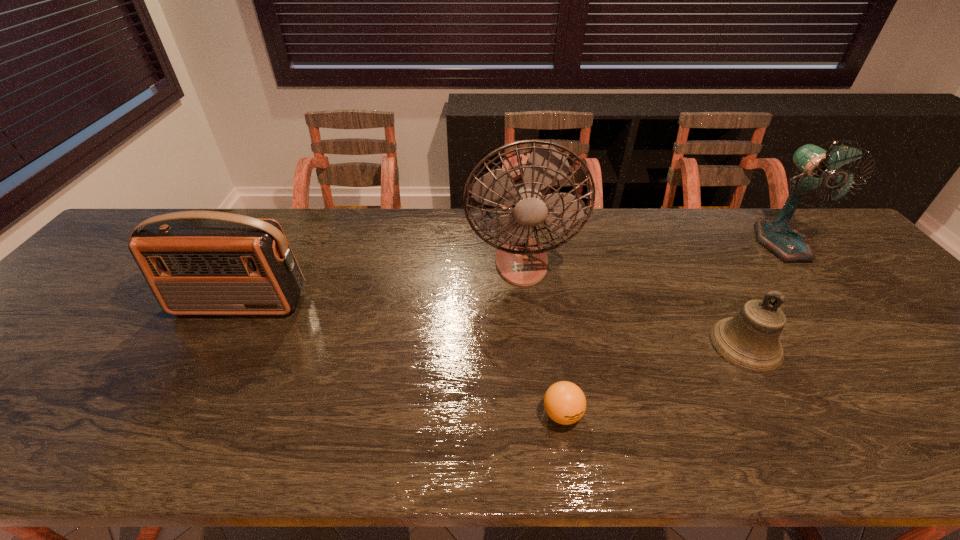
In the image, there is a desktop. Identify the location of free region at the far left corner. The height and width of the screenshot is (540, 960). [126, 253].

The height and width of the screenshot is (540, 960). Identify the location of free space between the third shortest object and the nearest object. click(x=401, y=359).

This screenshot has height=540, width=960. I want to click on free space between the second object from right to left and the right fan, so click(x=763, y=294).

Locate an element on the screen. Image resolution: width=960 pixels, height=540 pixels. empty space between the shortest object and the rightmost object is located at coordinates (672, 328).

Image resolution: width=960 pixels, height=540 pixels. I want to click on vacant space that's between the left fan and the fourth object from left to right, so click(634, 303).

This screenshot has width=960, height=540. I want to click on vacant space that's between the third shortest object and the left fan, so click(380, 283).

This screenshot has height=540, width=960. What are the coordinates of `empty space that is in between the left fan and the third tallest object` in the screenshot? It's located at (380, 283).

What are the coordinates of `empty location between the leftmost object and the left fan` in the screenshot? It's located at (380, 283).

Find the location of a particular element. The height and width of the screenshot is (540, 960). vacant space that is in between the leftmost object and the left fan is located at coordinates (380, 283).

At what (x,y) coordinates should I click in order to perform the action: click on empty space that is in between the second tallest object and the left fan. Please return your answer as a coordinate pair (x, y). The width and height of the screenshot is (960, 540). Looking at the image, I should click on (651, 252).